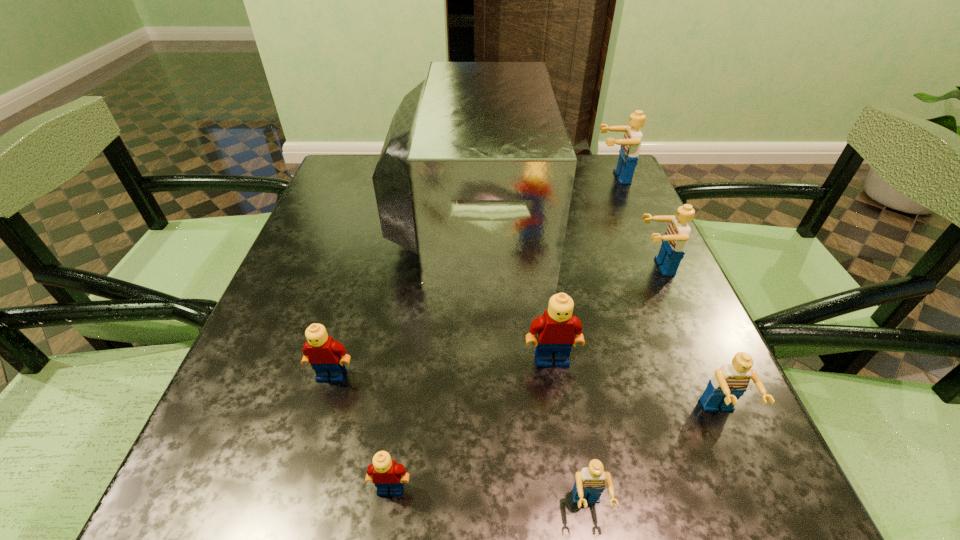
The image size is (960, 540). I want to click on the third farthest blue Lego, so click(x=729, y=383).

Identify the location of the smallest yellow Lego. [385, 473].

At what (x,y) coordinates should I click in order to perform the action: click on the nearest yellow Lego. Please return your answer as a coordinate pair (x, y). This screenshot has height=540, width=960. Looking at the image, I should click on (385, 473).

Where is `the nearest blue Lego`? the nearest blue Lego is located at coordinates (590, 482).

Locate an element on the screen. This screenshot has width=960, height=540. the smallest blue Lego is located at coordinates (590, 482).

You are a GUI agent. You are given a task and a screenshot of the screen. Output one action in this format:
    pyautogui.click(x=<x>, y=<y>)
    Task: Click on the vacant space located on the front-facing side of the white microwave oven
    This screenshot has height=540, width=960.
    Given the screenshot: What is the action you would take?
    pyautogui.click(x=569, y=213)

Image resolution: width=960 pixels, height=540 pixels. In order to click on free space located on the face of the farthest blue Lego in this screenshot , I will do `click(475, 177)`.

You are a GUI agent. You are given a task and a screenshot of the screen. Output one action in this format:
    pyautogui.click(x=<x>, y=<y>)
    Task: Click on the vacant space positioned 0.260m on the face of the farthest blue Lego
    
    Given the screenshot: What is the action you would take?
    pyautogui.click(x=498, y=177)

I want to click on vacant space located 0.240m on the face of the farthest blue Lego, so click(505, 177).

You are a GUI agent. You are given a task and a screenshot of the screen. Output one action in this format:
    pyautogui.click(x=<x>, y=<y>)
    Task: Click on the vacant area situated 0.270m on the face of the second farthest blue Lego
    
    Given the screenshot: What is the action you would take?
    pyautogui.click(x=506, y=267)